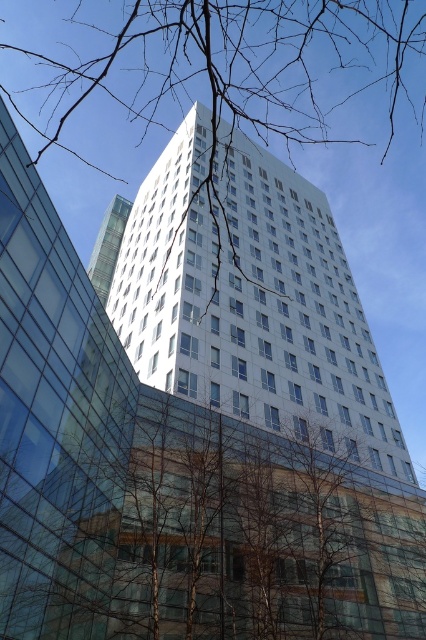
You are an architect analyzing the urban landscape. You observe the white glass building at center and the transparent glass building at center. Which building is taller?

The white glass building at center is taller than the transparent glass building at center according to the description provided.

You are a city planner analyzing the image. You need to determine the spatial relationship between the white glass building at center and the bare branches at upper center. Based on the scene, which object is located to the right of the other?

The white glass building at center is positioned on the right side of bare branches at upper center, so the white glass building at center is to the right of the bare branches at upper center.

You are a city planner assessing the view from a nearby park. You notice the brown leafless tree at lower center and the white glass building at center. Which object appears shorter in the image?

The brown leafless tree at lower center appears shorter than the white glass building at center because it has a lesser height compared to it.